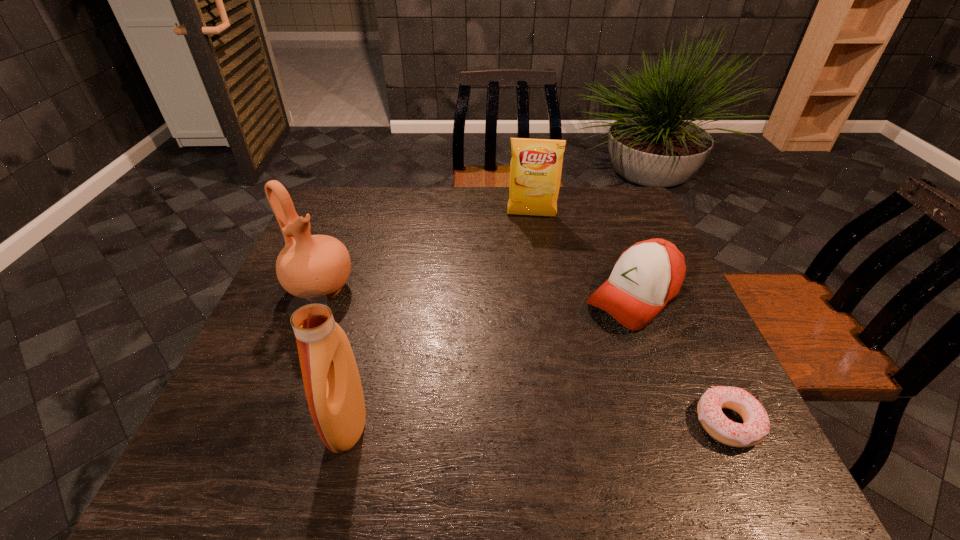
Where is `free spot on the desktop that is between the detergent and the doughnut and is positioned on the front of the farthest object with the logo`? free spot on the desktop that is between the detergent and the doughnut and is positioned on the front of the farthest object with the logo is located at coordinates (526, 423).

Find the location of a particular element. Image resolution: width=960 pixels, height=540 pixels. free spot on the desktop that is between the fourth object from right to left and the doughnut and is positioned on the spout of the leftmost object is located at coordinates (489, 423).

Find the location of `vacant space on the desktop that is between the second object from left to right and the doughnut and is positioned on the front-facing side of the fourth tallest object`. vacant space on the desktop that is between the second object from left to right and the doughnut and is positioned on the front-facing side of the fourth tallest object is located at coordinates (485, 423).